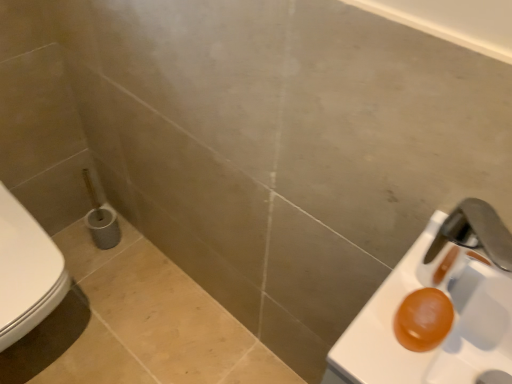
Question: Is orange translucent soap at right to the left of white glossy toilet at left from the viewer's perspective?

Choices:
 (A) yes
 (B) no

Answer: (B)

Question: Does orange translucent soap at right have a smaller size compared to white glossy toilet at left?

Choices:
 (A) no
 (B) yes

Answer: (B)

Question: From the image's perspective, is orange translucent soap at right over white glossy toilet at left?

Choices:
 (A) yes
 (B) no

Answer: (B)

Question: Considering the relative positions of orange translucent soap at right and white glossy toilet at left in the image provided, is orange translucent soap at right behind white glossy toilet at left?

Choices:
 (A) no
 (B) yes

Answer: (A)

Question: From the image's perspective, is orange translucent soap at right below white glossy toilet at left?

Choices:
 (A) no
 (B) yes

Answer: (B)

Question: Is orange translucent soap at right to the right of white glossy toilet at left from the viewer's perspective?

Choices:
 (A) no
 (B) yes

Answer: (B)

Question: From the image's perspective, is white glossy toilet at left on top of orange translucent soap at right?

Choices:
 (A) yes
 (B) no

Answer: (A)

Question: From a real-world perspective, is white glossy toilet at left located higher than orange translucent soap at right?

Choices:
 (A) yes
 (B) no

Answer: (B)

Question: Is white glossy toilet at left looking in the opposite direction of orange translucent soap at right?

Choices:
 (A) no
 (B) yes

Answer: (A)

Question: Does white glossy toilet at left appear on the left side of orange translucent soap at right?

Choices:
 (A) no
 (B) yes

Answer: (B)

Question: Does white glossy toilet at left turn towards orange translucent soap at right?

Choices:
 (A) no
 (B) yes

Answer: (A)

Question: Considering the relative sizes of white glossy toilet at left and orange translucent soap at right in the image provided, is white glossy toilet at left shorter than orange translucent soap at right?

Choices:
 (A) no
 (B) yes

Answer: (A)

Question: Considering the positions of orange translucent soap at right and white glossy toilet at left in the image, is orange translucent soap at right wider or thinner than white glossy toilet at left?

Choices:
 (A) thin
 (B) wide

Answer: (A)